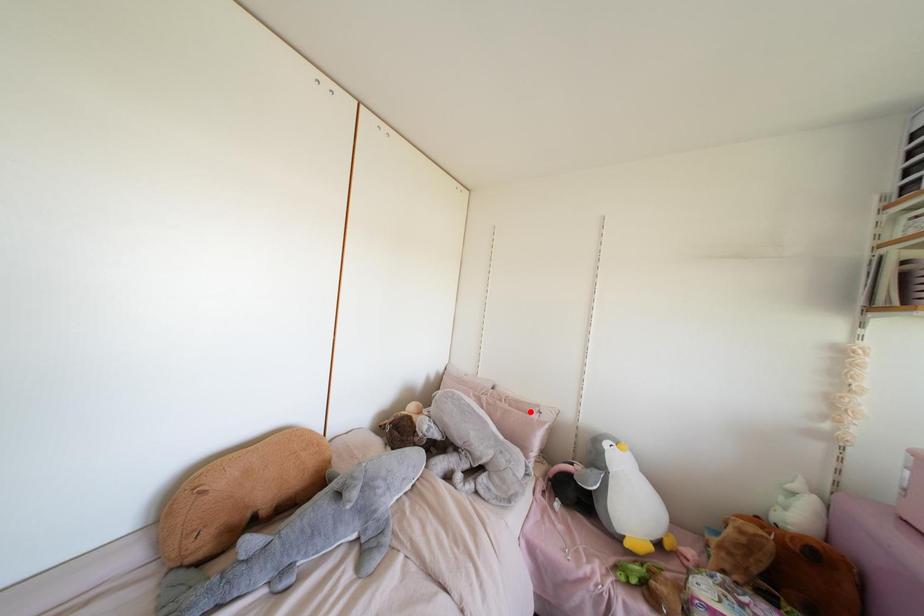
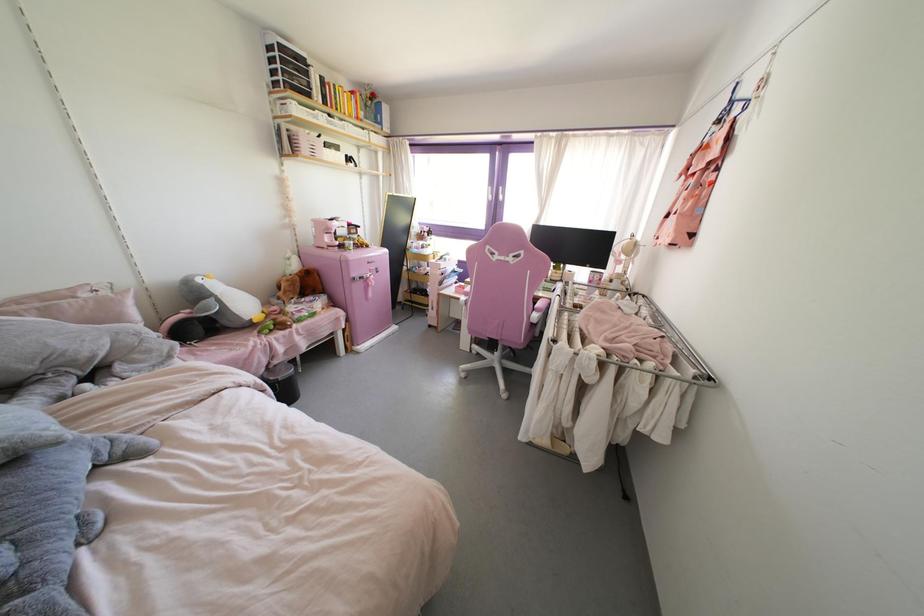
In the second image, find the point that corresponds to the highlighted location in the first image.

(83, 294)